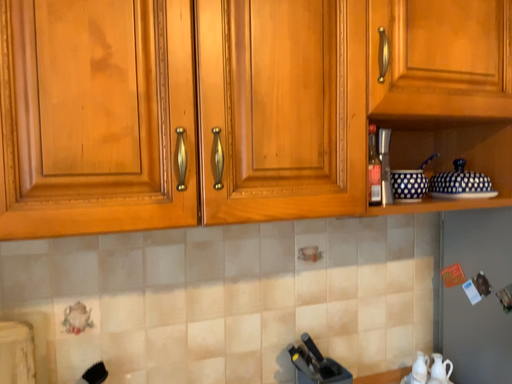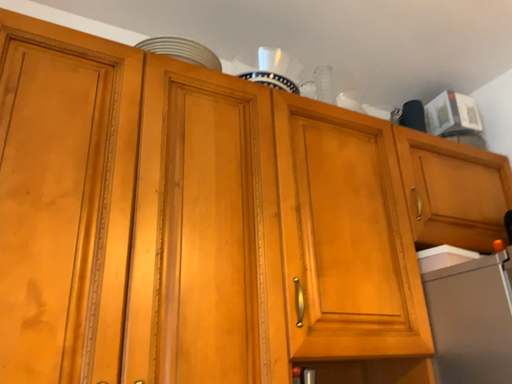
Question: How did the camera likely rotate when shooting the video?

Choices:
 (A) rotated left
 (B) rotated right

Answer: (B)